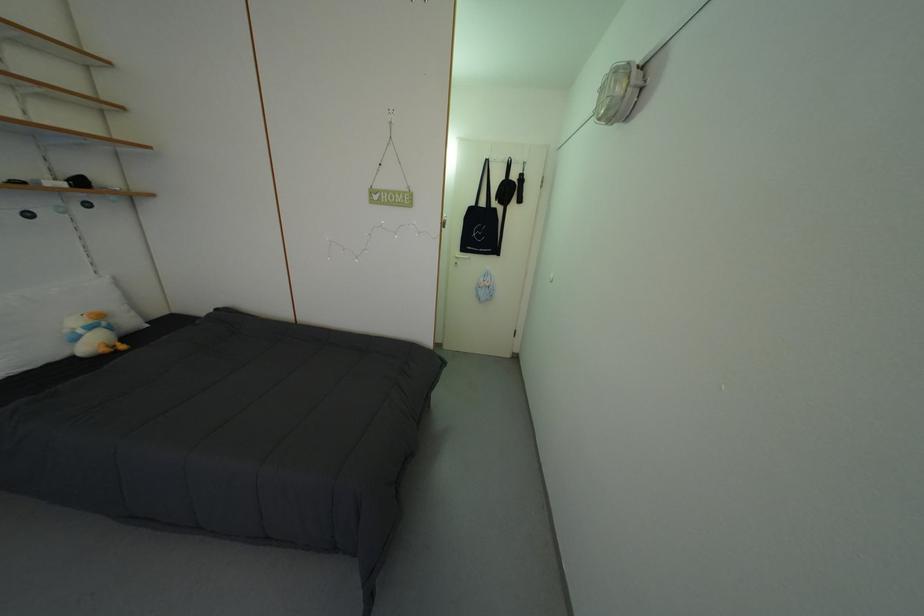
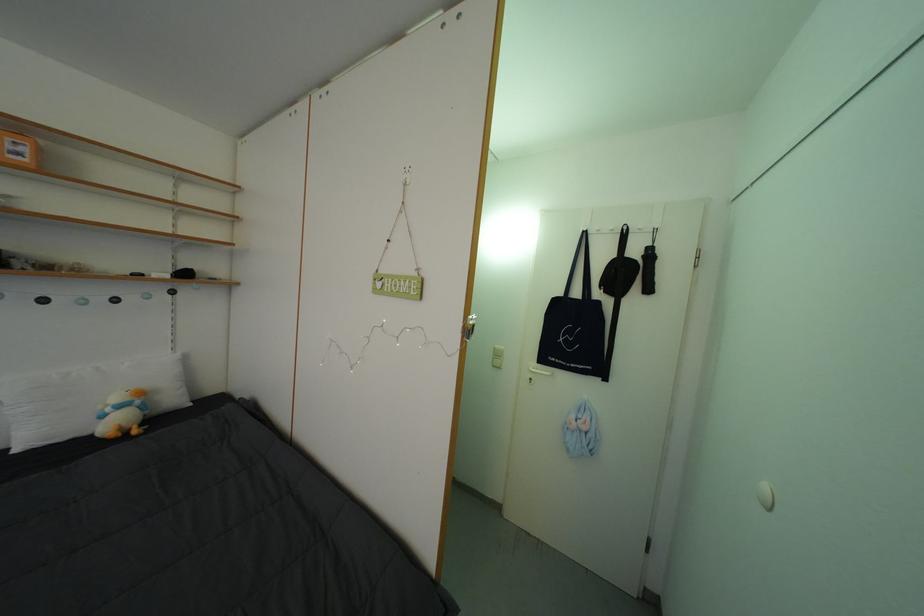
Locate, in the second image, the point that corresponds to (523,183) in the first image.

(642, 257)